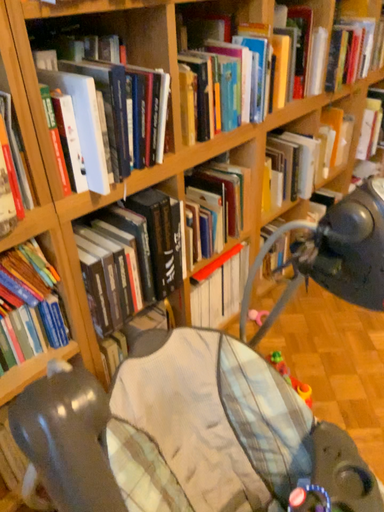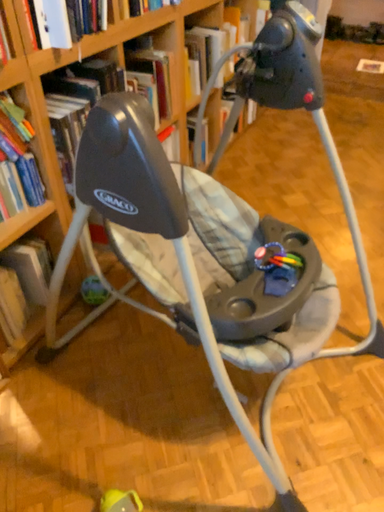
Question: How did the camera likely rotate when shooting the video?

Choices:
 (A) rotated right
 (B) rotated left

Answer: (A)